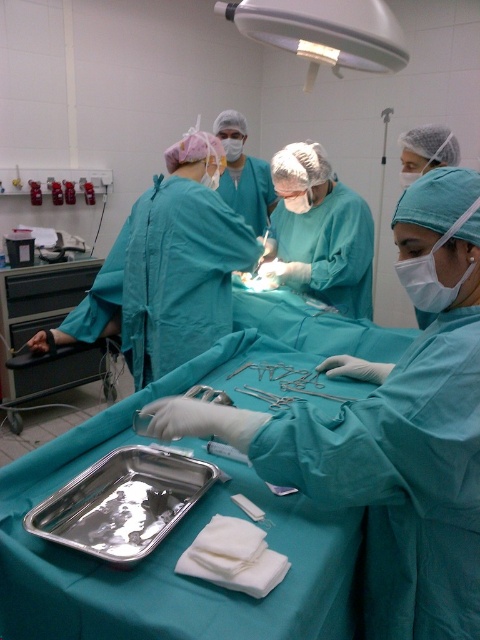
Which is in front, point (427, 461) or point (110, 548)?

Point (427, 461) is more forward.

Is teal matte surgical gown at center shorter than silver metallic tray at lower left?

In fact, teal matte surgical gown at center may be taller than silver metallic tray at lower left.

Between point (252, 428) and point (141, 536), which one is positioned in front?

Point (252, 428) is more forward.

Locate an element on the screen. The image size is (480, 640). teal matte surgical gown at center is located at coordinates (393, 429).

Can you confirm if silver metallic tray at lower left is taller than satin silver scissors at center?

Yes.

Looking at this image, is silver metallic tray at lower left below satin silver scissors at center?

Yes, silver metallic tray at lower left is below satin silver scissors at center.

Which is in front, point (82, 552) or point (204, 392)?

Point (82, 552) is more forward.

Where is `silver metallic tray at lower left`? This screenshot has height=640, width=480. silver metallic tray at lower left is located at coordinates (122, 502).

Can you confirm if teal matte surgical gown at center is positioned to the right of satin silver scissors at center?

Yes, teal matte surgical gown at center is to the right of satin silver scissors at center.

Between teal matte surgical gown at center and satin silver scissors at center, which one has less height?

satin silver scissors at center

Does point (465, 259) come farther from viewer compared to point (204, 392)?

No, (465, 259) is in front of (204, 392).

You are a GUI agent. You are given a task and a screenshot of the screen. Output one action in this format:
    pyautogui.click(x=<x>, y=<y>)
    Task: Click on the teal matte surgical gown at center
    
    Given the screenshot: What is the action you would take?
    pyautogui.click(x=393, y=429)